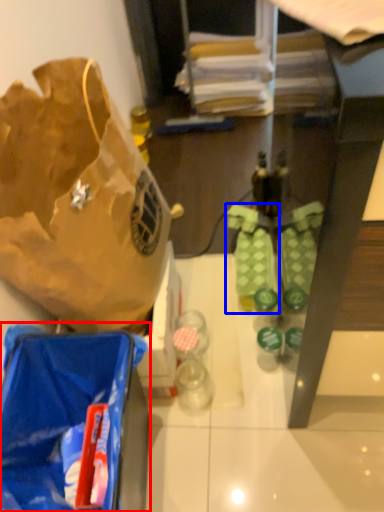
Question: Among these objects, which one is nearest to the camera, luggage and bags (highlighted by a red box) or footwear (highlighted by a blue box)?

Choices:
 (A) luggage and bags
 (B) footwear

Answer: (A)